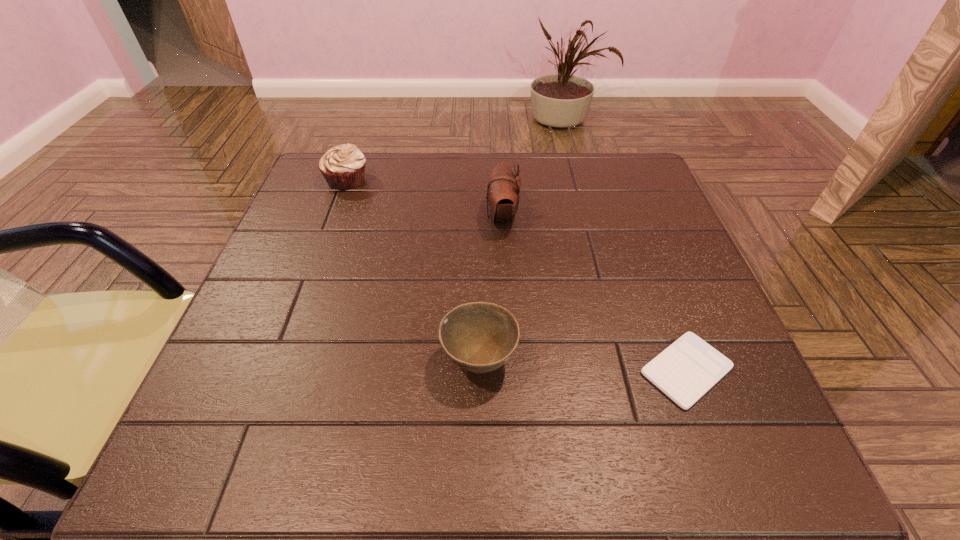
Identify the location of vacant space located 0.180m on the front of the muffin. (324, 241).

The width and height of the screenshot is (960, 540). I want to click on vacant point located 0.130m on the back of the bowl, so pos(479,278).

Find the location of a particular element. vacant region located on the back of the shortest object is located at coordinates (655, 286).

This screenshot has height=540, width=960. I want to click on pouch situated at the far edge, so click(x=503, y=192).

The height and width of the screenshot is (540, 960). In order to click on muffin that is at the far edge in this screenshot , I will do `click(343, 166)`.

The width and height of the screenshot is (960, 540). Find the location of `object present at the left edge`. object present at the left edge is located at coordinates (343, 166).

Find the location of a particular element. The height and width of the screenshot is (540, 960). object that is at the right edge is located at coordinates (687, 369).

The image size is (960, 540). I want to click on object at the far left corner, so click(343, 166).

Locate an element on the screen. vacant space at the far edge is located at coordinates [x=454, y=195].

Where is `blank space at the near edge`? blank space at the near edge is located at coordinates (480, 420).